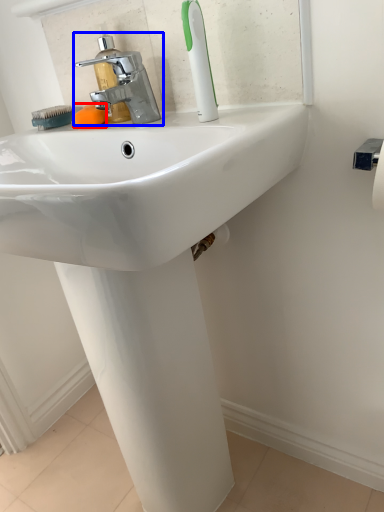
Question: Among these objects, which one is farthest to the camera, soap (highlighted by a red box) or tap (highlighted by a blue box)?

Choices:
 (A) soap
 (B) tap

Answer: (A)